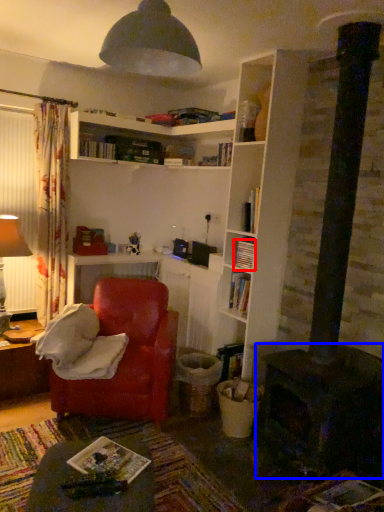
Question: Which object is further to the camera taking this photo, book (highlighted by a red box) or fireplace (highlighted by a blue box)?

Choices:
 (A) book
 (B) fireplace

Answer: (A)